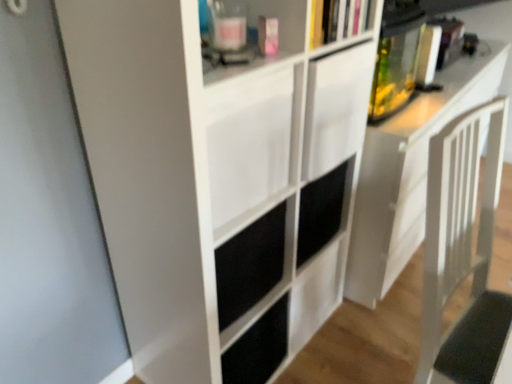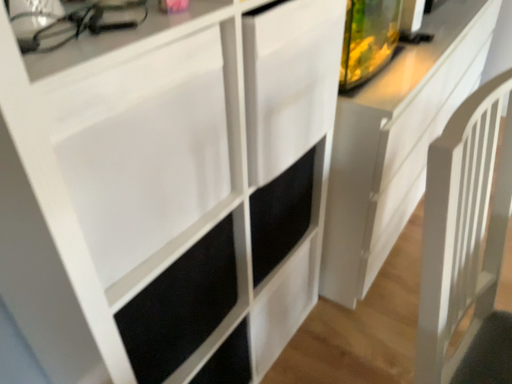
Question: Which way did the camera rotate in the video?

Choices:
 (A) rotated downward
 (B) rotated upward

Answer: (A)